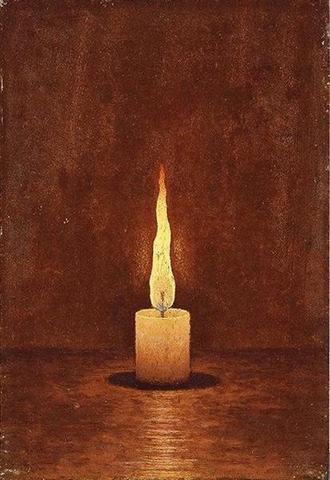
At what (x,y) coordinates should I click in order to perform the action: click on light around candle flame. Please return your answer as a coordinate pair (x, y). This screenshot has width=330, height=480. Looking at the image, I should click on (183, 253), (142, 251).